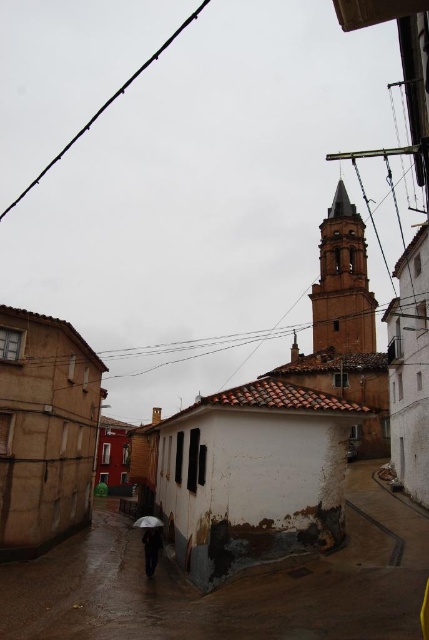
You are a delivery person carrying a package that is 10 meters long. You need to navigate through the street shown in the image. Can you pass between the rusty concrete alley at lower center and the white matte umbrella at lower center without dropping your package?

The rusty concrete alley at lower center and the white matte umbrella at lower center are 9.98 meters apart from each other. Since your package is 10 meters long, it is slightly too long to fit through the space between them. You should find an alternative route or reposition your package to ensure safe passage.

You are a delivery person carrying a package and need to navigate through the street. There is a rusty concrete alley at lower center and a dark fabric umbrella at lower center. Which object can you pass through more easily?

The rusty concrete alley at lower center is bigger than the dark fabric umbrella at lower center, so you can pass through the rusty concrete alley at lower center more easily.